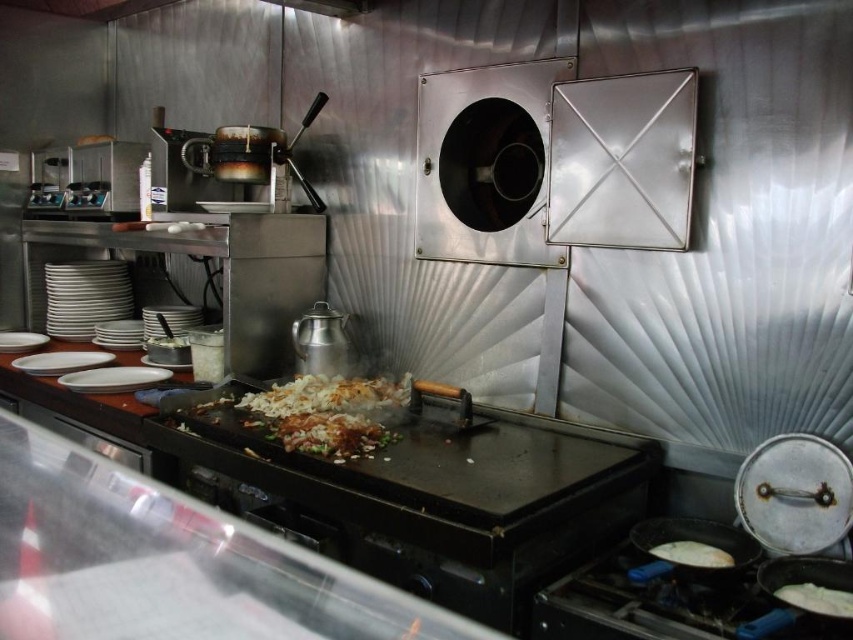
Question: Is smooth black pan at lower right to the left of white matte flatbread at lower right from the viewer's perspective?

Choices:
 (A) no
 (B) yes

Answer: (B)

Question: Is black matte griddle at center positioned in front of white matte plate at lower left?

Choices:
 (A) no
 (B) yes

Answer: (B)

Question: Which object appears farthest from the camera in this image?

Choices:
 (A) smooth black pan at lower right
 (B) white matte flatbread at lower right
 (C) white fluffy pancake at lower right

Answer: (B)

Question: Does smooth black pan at lower right appear over white matte plate at left?

Choices:
 (A) no
 (B) yes

Answer: (A)

Question: Considering the real-world distances, which object is closest to the black matte griddle at center?

Choices:
 (A) white matte plate at center
 (B) smooth black pan at lower right
 (C) white matte plate at lower left

Answer: (B)

Question: Which object is the closest to the black matte griddle at center?

Choices:
 (A) white matte flatbread at lower right
 (B) white matte plate at center
 (C) smooth black pan at lower right

Answer: (C)